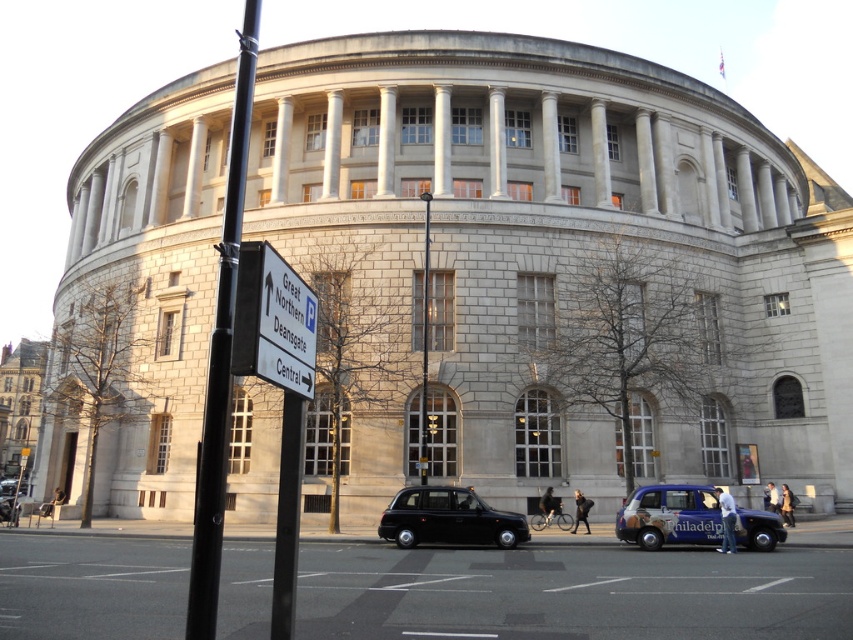
Question: Can you confirm if white plastic sign at upper center is wider than blue metallic taxi at lower center?

Choices:
 (A) yes
 (B) no

Answer: (B)

Question: Which object is farther from the camera taking this photo?

Choices:
 (A) blue metallic taxi at lower center
 (B) shiny black taxi at center

Answer: (B)

Question: Can you confirm if white plastic sign at upper center is positioned to the left of shiny black taxi at center?

Choices:
 (A) yes
 (B) no

Answer: (A)

Question: Estimate the real-world distances between objects in this image. Which object is farther from the blue metallic taxi at lower center?

Choices:
 (A) white plastic sign at upper center
 (B) black metal pole at center
 (C) shiny black taxi at center

Answer: (A)

Question: Which object is farther from the camera taking this photo?

Choices:
 (A) white plastic sign at upper center
 (B) blue metallic taxi at lower center
 (C) black metal pole at center

Answer: (B)

Question: Does blue metallic taxi at lower center appear on the left side of shiny black taxi at center?

Choices:
 (A) yes
 (B) no

Answer: (B)